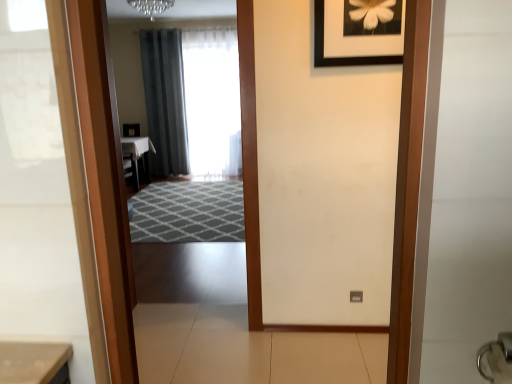
Question: Which direction should I rotate to look at white sheer curtain at center, the first curtain from the right?

Choices:
 (A) left
 (B) right

Answer: (A)

Question: Does white glossy table at center come behind black matte picture frame at upper center?

Choices:
 (A) yes
 (B) no

Answer: (A)

Question: Considering the relative positions of white glossy table at center and black matte picture frame at upper center in the image provided, is white glossy table at center to the left of black matte picture frame at upper center from the viewer's perspective?

Choices:
 (A) no
 (B) yes

Answer: (B)

Question: Is white glossy table at center touching black matte picture frame at upper center?

Choices:
 (A) yes
 (B) no

Answer: (B)

Question: From the image's perspective, is white glossy table at center over black matte picture frame at upper center?

Choices:
 (A) yes
 (B) no

Answer: (B)

Question: Is white glossy table at center bigger than black matte picture frame at upper center?

Choices:
 (A) yes
 (B) no

Answer: (A)

Question: Is white glossy table at center located outside black matte picture frame at upper center?

Choices:
 (A) yes
 (B) no

Answer: (A)

Question: Does dark gray fabric curtain at center, acting as the first curtain starting from the left, have a larger size compared to white glossy table at center?

Choices:
 (A) no
 (B) yes

Answer: (B)

Question: Considering the relative sizes of dark gray fabric curtain at center, acting as the first curtain starting from the left, and white glossy table at center in the image provided, is dark gray fabric curtain at center, acting as the first curtain starting from the left, shorter than white glossy table at center?

Choices:
 (A) yes
 (B) no

Answer: (B)

Question: Does dark gray fabric curtain at center, which appears as the 2th curtain when viewed from the right, come behind white glossy table at center?

Choices:
 (A) yes
 (B) no

Answer: (A)

Question: Is there a large distance between dark gray fabric curtain at center, acting as the first curtain starting from the left, and white glossy table at center?

Choices:
 (A) no
 (B) yes

Answer: (A)

Question: Is dark gray fabric curtain at center, which appears as the 2th curtain when viewed from the right, positioned beyond the bounds of white glossy table at center?

Choices:
 (A) yes
 (B) no

Answer: (A)

Question: Is dark gray fabric curtain at center, which appears as the 2th curtain when viewed from the right, placed right next to white glossy table at center?

Choices:
 (A) no
 (B) yes

Answer: (A)

Question: Can you confirm if silver metallic door handle at lower right is positioned to the right of black matte picture frame at upper center?

Choices:
 (A) yes
 (B) no

Answer: (A)